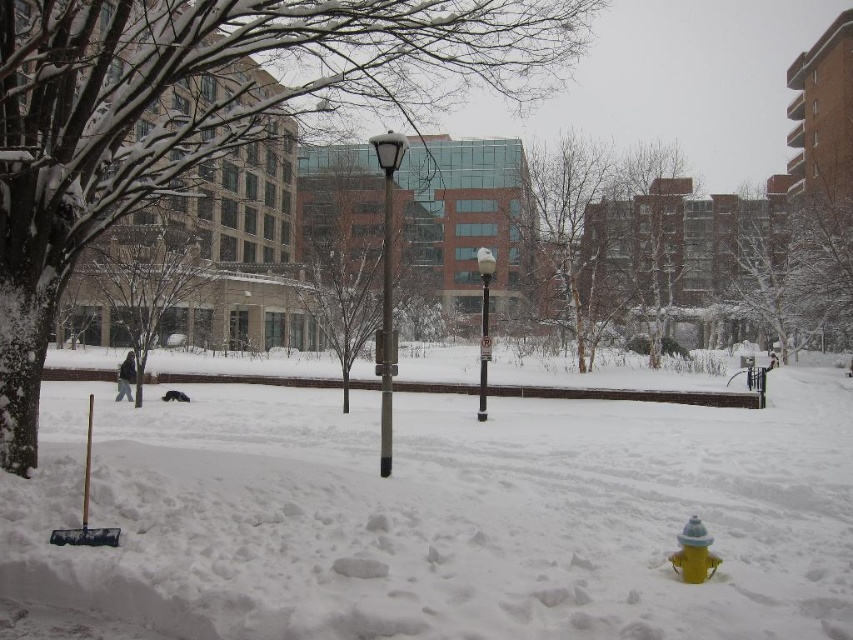
Who is taller, yellow matte hydrant at lower right or white glossy lamp post at center?

white glossy lamp post at center is taller.

Is yellow matte hydrant at lower right thinner than white glossy lamp post at center?

Indeed, yellow matte hydrant at lower right has a lesser width compared to white glossy lamp post at center.

At what (x,y) coordinates should I click in order to perform the action: click on yellow matte hydrant at lower right. Please return your answer as a coordinate pair (x, y). Looking at the image, I should click on (693, 552).

Is point (674, 160) closer to camera compared to point (674, 557)?

No, (674, 160) is further to viewer.

Can you confirm if bare branches at center is positioned to the right of yellow matte hydrant at lower right?

Indeed, bare branches at center is positioned on the right side of yellow matte hydrant at lower right.

Which is in front, point (636, 266) or point (695, 560)?

Positioned in front is point (695, 560).

At what (x,y) coordinates should I click in order to perform the action: click on bare branches at center. Please return your answer as a coordinate pair (x, y). The height and width of the screenshot is (640, 853). Looking at the image, I should click on (651, 236).

Is snow-covered tree at center to the left of satin black lamp post at center from the viewer's perspective?

In fact, snow-covered tree at center is to the right of satin black lamp post at center.

Who is positioned more to the left, snow-covered tree at center or satin black lamp post at center?

From the viewer's perspective, satin black lamp post at center appears more on the left side.

Which is behind, point (531, 221) or point (387, 131)?

Point (531, 221)

Find the location of a particular element. The width and height of the screenshot is (853, 640). snow-covered tree at center is located at coordinates (601, 237).